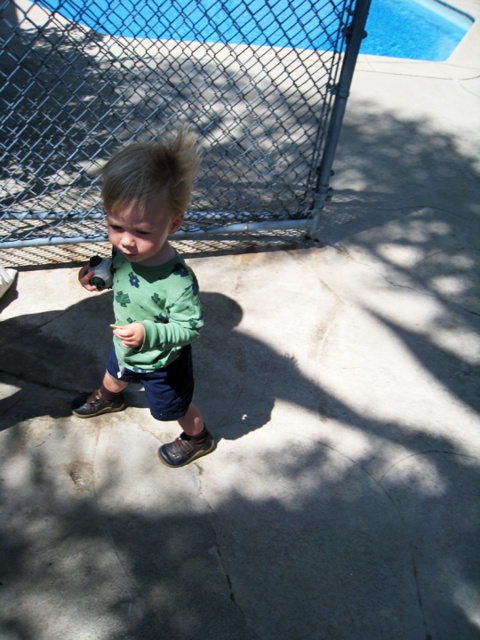
Question: Which object is positioned closest to the blue glass pool at upper center?

Choices:
 (A) metallic chain-link fence at center
 (B) green cotton shirt at center
 (C) blonde fuzzy hair at center

Answer: (A)

Question: Which of these objects is positioned closest to the metallic chain-link fence at center?

Choices:
 (A) blue glass pool at upper center
 (B) green cotton shirt at center
 (C) blonde fuzzy hair at center

Answer: (A)

Question: Does blue glass pool at upper center have a greater width compared to blonde fuzzy hair at center?

Choices:
 (A) no
 (B) yes

Answer: (B)

Question: Which point is closer to the camera?

Choices:
 (A) (178, 307)
 (B) (134, 134)
 (C) (173, 202)

Answer: (C)

Question: Is metallic chain-link fence at center to the right of green cotton shirt at center from the viewer's perspective?

Choices:
 (A) no
 (B) yes

Answer: (A)

Question: Where is metallic chain-link fence at center located in relation to blue glass pool at upper center in the image?

Choices:
 (A) above
 (B) below

Answer: (B)